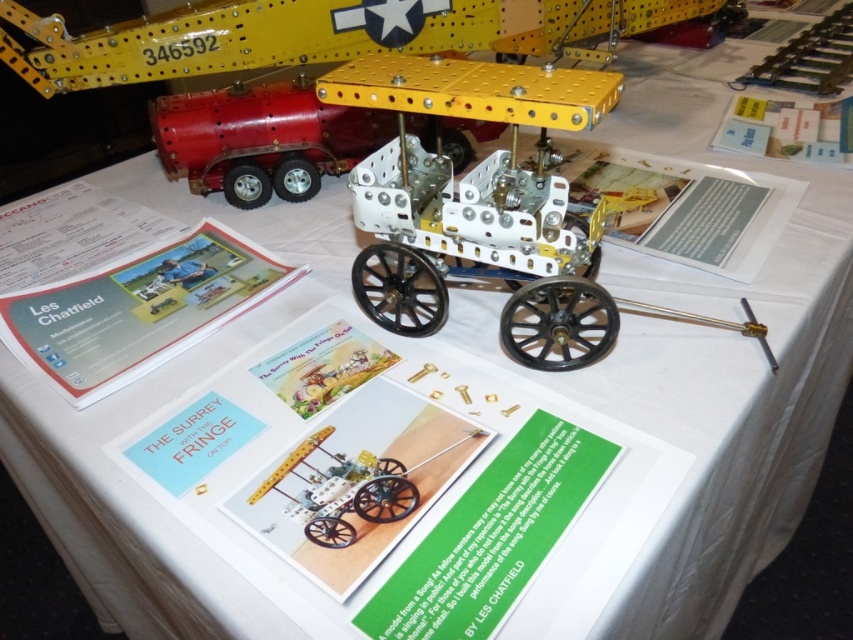
Please look at the table where the vintage vehicle model is displayed. There are printed materials and a yellow stand. Can you tell me what object is located at the coordinate point marked as (x=486, y=208) on the table?

The point marked at (x=486, y=208) on the table corresponds to the metallic yellow frame at center.

You are a curator arranging an exhibit. You need to place a label next to the metallic yellow frame at center so visitors can easily see both it and the metallic red trailer at upper left. Where should you place the label?

The label should be placed near the metallic yellow frame at center since it is positioned under the metallic red trailer at upper left, ensuring visitors can view both items without obstruction.